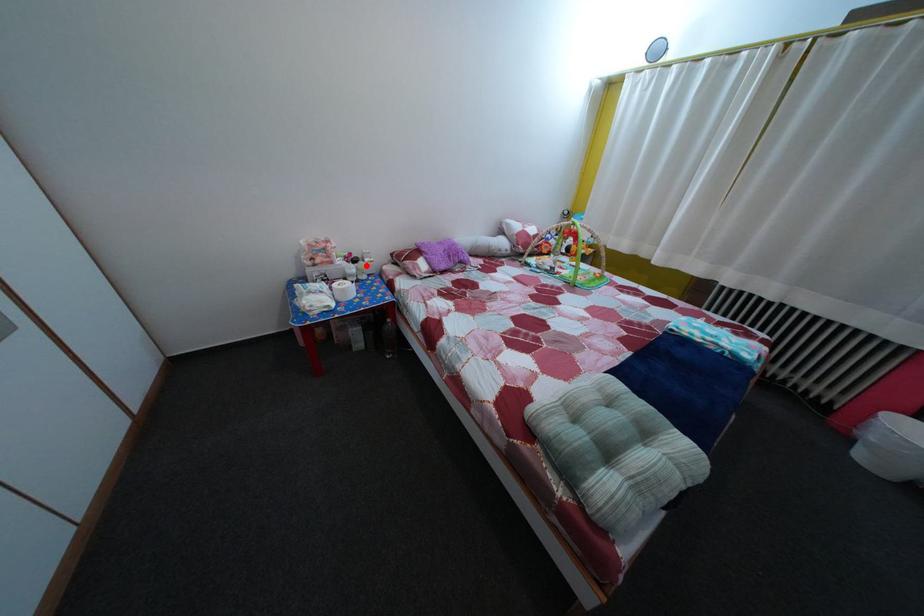
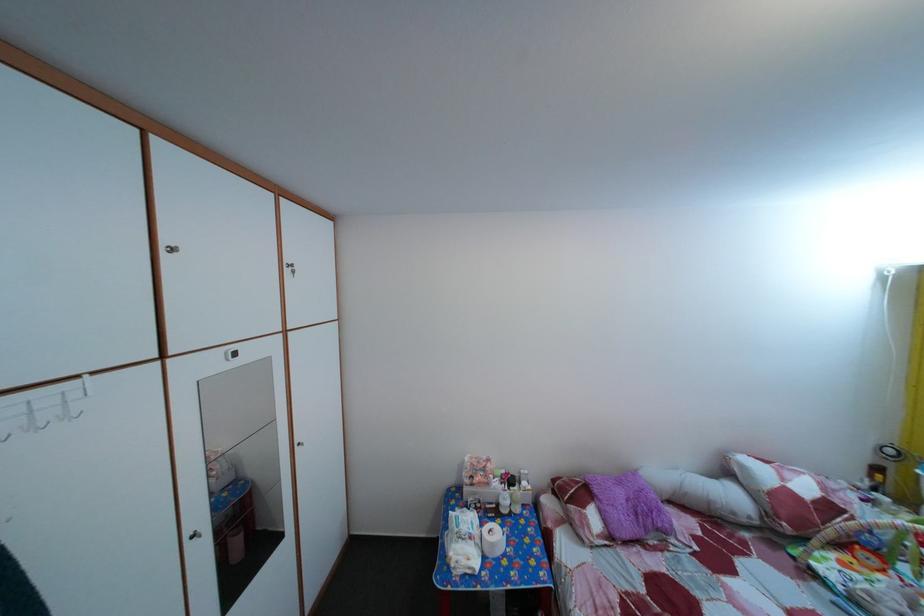
Question: I am providing you with two images of the same scene from different viewpoints. Given a red point in image1, look at the same physical point in image2. Is it:

Choices:
 (A) Closer to the viewpoint
 (B) Farther from the viewpoint

Answer: (B)